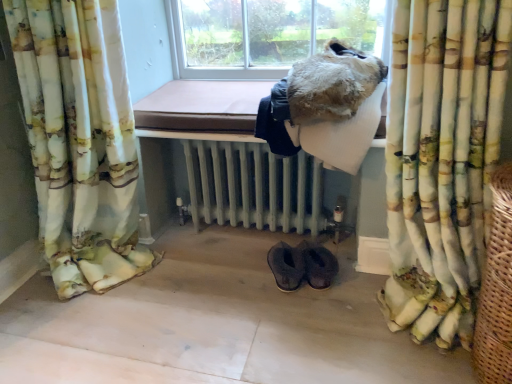
Identify the location of free space in front of brown suede slippers at lower center. The image size is (512, 384). (312, 326).